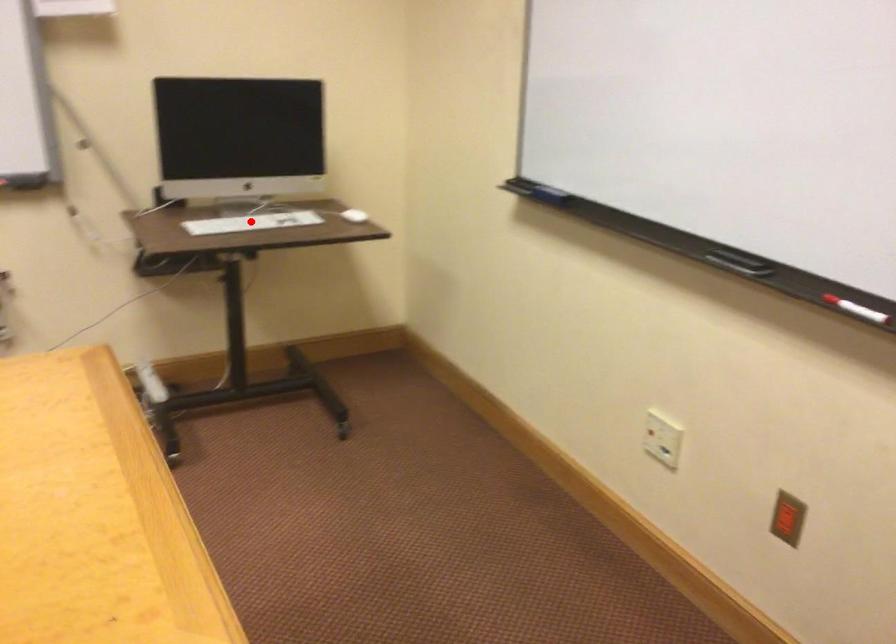
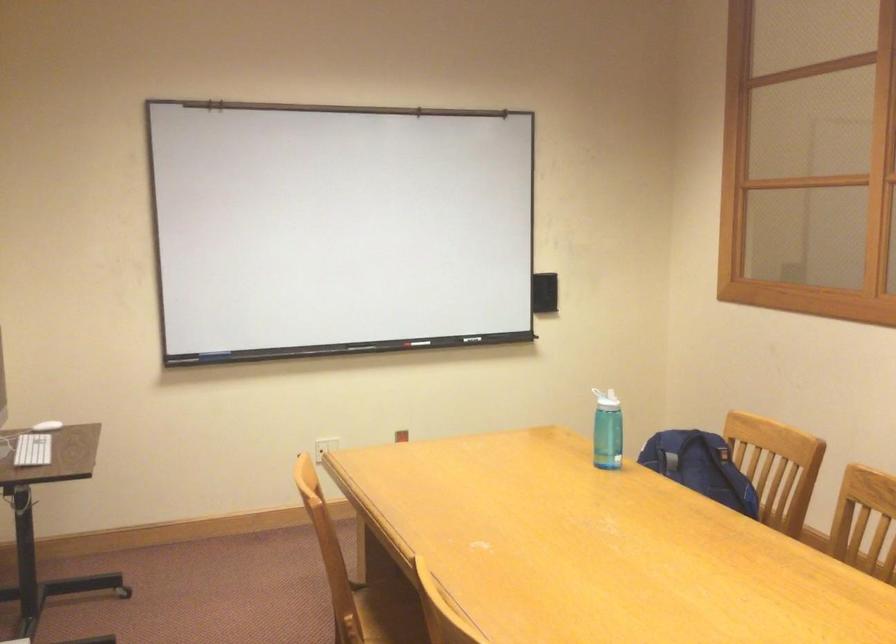
The point at the highlighted location is marked in the first image. Where is the corresponding point in the second image?

(32, 450)